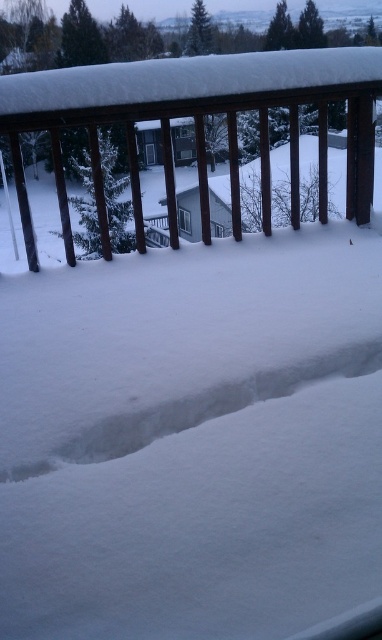
Question: Does wooden railing at upper center appear over white snow at lower center?

Choices:
 (A) yes
 (B) no

Answer: (A)

Question: Which object appears farthest from the camera in this image?

Choices:
 (A) wooden railing at upper center
 (B) white snow at lower center

Answer: (A)

Question: Which of the following is the closest to the observer?

Choices:
 (A) (200, 392)
 (B) (153, 116)

Answer: (A)

Question: Is wooden railing at upper center to the left of white snow at lower center from the viewer's perspective?

Choices:
 (A) no
 (B) yes

Answer: (B)

Question: Is wooden railing at upper center above white snow at lower center?

Choices:
 (A) no
 (B) yes

Answer: (B)